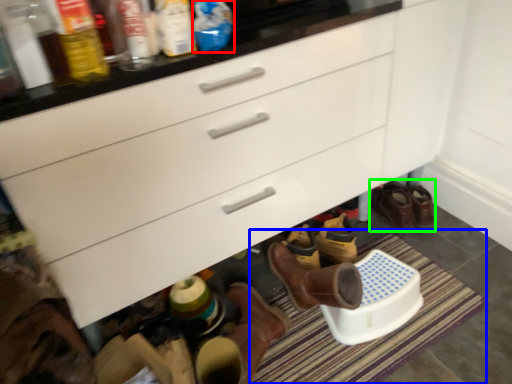
Question: Which is nearer to the bottle (highlighted by a red box)? bath mat (highlighted by a blue box) or footwear (highlighted by a green box).

Choices:
 (A) bath mat
 (B) footwear

Answer: (A)